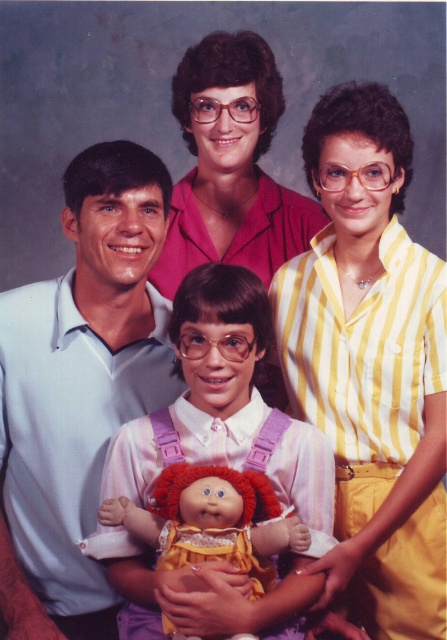
Question: Can you confirm if light blue cotton shirt at left is wider than plush fabric doll at center?

Choices:
 (A) no
 (B) yes

Answer: (B)

Question: Estimate the real-world distances between objects in this image. Which object is closer to the yellow striped shirt at upper right?

Choices:
 (A) plush fabric doll at center
 (B) light blue cotton shirt at left

Answer: (A)

Question: Which object is the closest to the plush fabric doll at center?

Choices:
 (A) light blue cotton shirt at left
 (B) yellow striped shirt at upper right

Answer: (B)

Question: Is light blue cotton shirt at left smaller than plush fabric doll at center?

Choices:
 (A) yes
 (B) no

Answer: (B)

Question: Does light blue cotton shirt at left have a larger size compared to plush fabric doll at center?

Choices:
 (A) no
 (B) yes

Answer: (B)

Question: Which of these objects is positioned closest to the yellow striped shirt at upper right?

Choices:
 (A) light blue cotton shirt at left
 (B) plush fabric doll at center

Answer: (B)